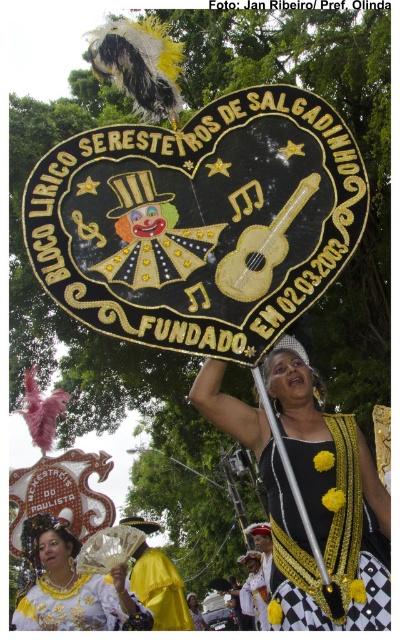
Question: Observing the image, what is the correct spatial positioning of white satin fan at lower left in reference to yellow satin cape at center?

Choices:
 (A) above
 (B) below

Answer: (A)

Question: Does gold metallic sash at center have a larger size compared to yellow satin cape at center?

Choices:
 (A) no
 (B) yes

Answer: (A)

Question: Which point is farther to the camera?

Choices:
 (A) yellow satin cape at center
 (B) gold metallic sash at center
 (C) white satin fan at lower left

Answer: (A)

Question: Which of these objects is positioned farthest from the yellow satin cape at center?

Choices:
 (A) black/yellow fabric dress at center
 (B) gold metallic sash at center
 (C) white satin fan at lower left

Answer: (A)

Question: Which of the following is the farthest from the observer?

Choices:
 (A) (342, 579)
 (B) (74, 598)
 (C) (135, 579)

Answer: (C)

Question: Considering the relative positions of gold metallic sash at center and yellow satin cape at center in the image provided, where is gold metallic sash at center located with respect to yellow satin cape at center?

Choices:
 (A) below
 (B) above

Answer: (B)